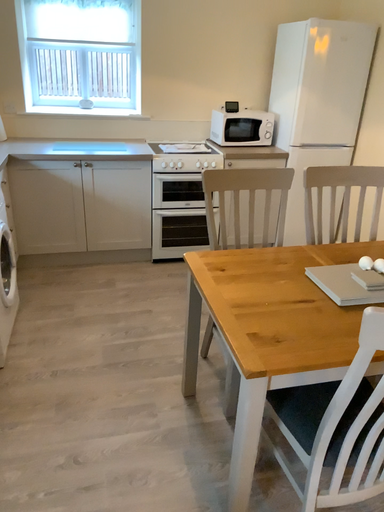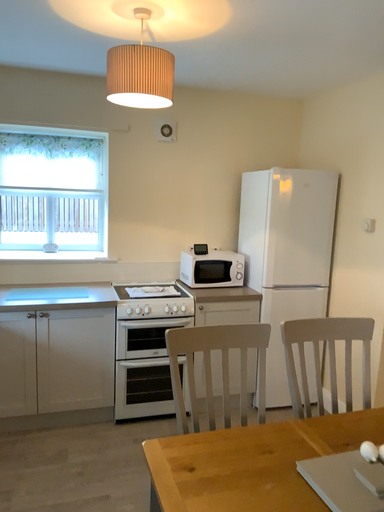
Question: How did the camera likely rotate when shooting the video?

Choices:
 (A) rotated downward
 (B) rotated upward

Answer: (B)